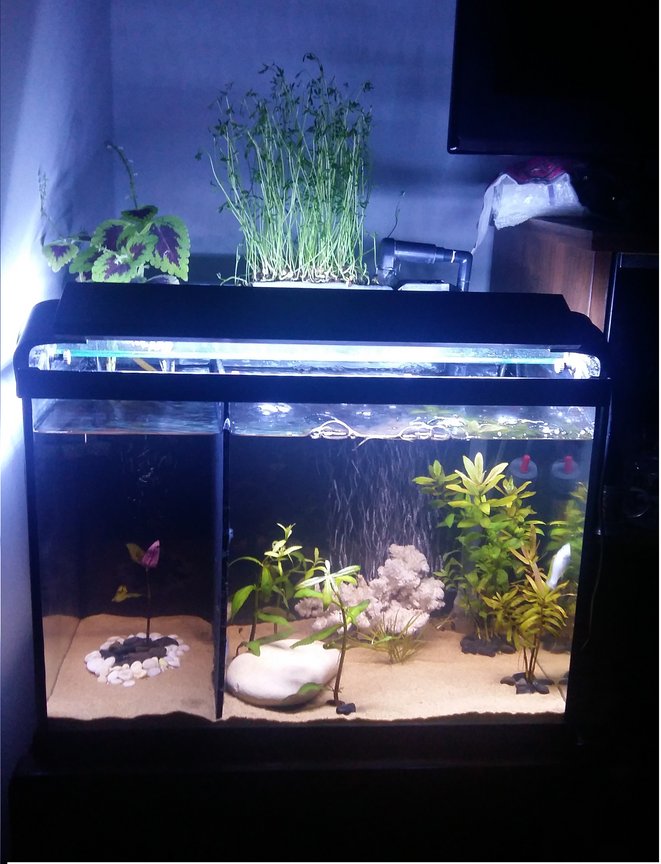
At what (x,y) coordinates should I click in order to perform the action: click on aquarium light. Please return your answer as a coordinate pair (x, y). Looking at the image, I should click on 319,353.